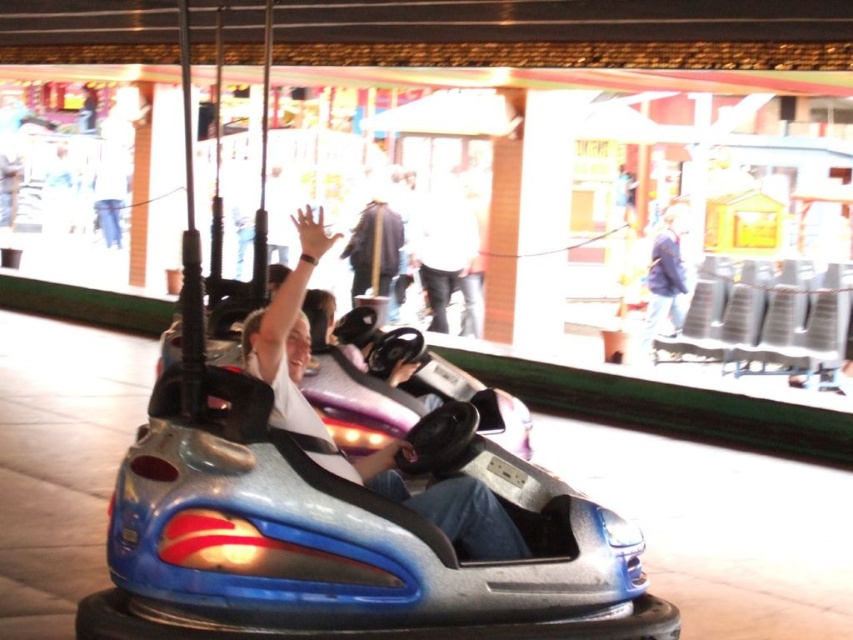
Can you confirm if matte white shirt at center is positioned to the right of blue fabric jacket at upper right?

No, matte white shirt at center is not to the right of blue fabric jacket at upper right.

Does matte white shirt at center appear on the left side of blue fabric jacket at upper right?

Indeed, matte white shirt at center is positioned on the left side of blue fabric jacket at upper right.

Locate an element on the screen. The height and width of the screenshot is (640, 853). matte white shirt at center is located at coordinates (288, 333).

This screenshot has height=640, width=853. Find the location of `matte white shirt at center`. matte white shirt at center is located at coordinates (288, 333).